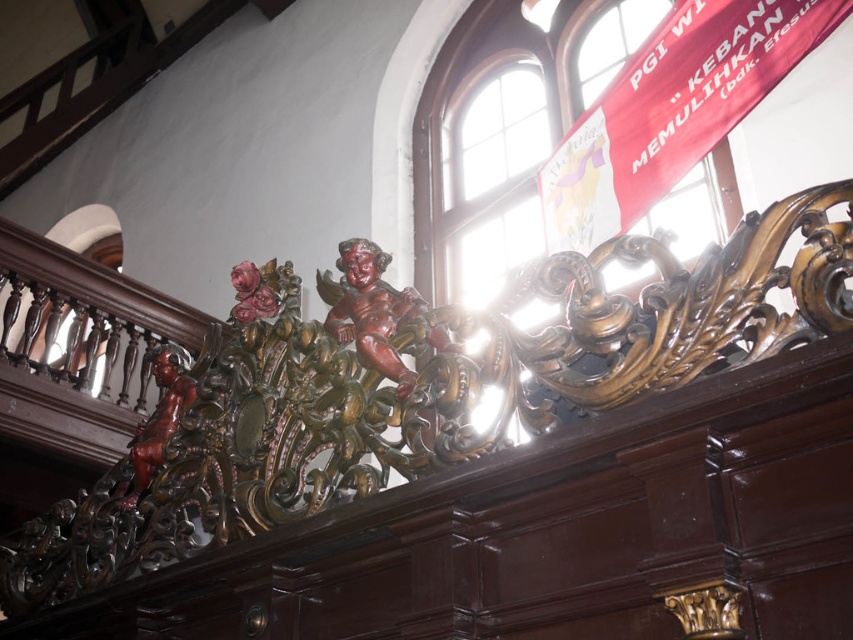
Does transparent glass window at upper center have a lesser height compared to polished dark wood cherub at center?

Incorrect, transparent glass window at upper center's height does not fall short of polished dark wood cherub at center's.

Which of these two, transparent glass window at upper center or polished dark wood cherub at center, stands taller?

transparent glass window at upper center is taller.

Measure the distance between transparent glass window at upper center and camera.

transparent glass window at upper center and camera are 18.27 meters apart from each other.

Identify the location of transparent glass window at upper center. (491, 141).

Can you confirm if wooden carving at center is bigger than transparent glass window at upper center?

Yes.

Does wooden carving at center come in front of transparent glass window at upper center?

That is True.

Where is `wooden carving at center`? wooden carving at center is located at coordinates (486, 461).

The width and height of the screenshot is (853, 640). I want to click on wooden carving at center, so click(486, 461).

Does wooden carving at center have a lesser width compared to polished dark wood cherub at center?

No.

Looking at this image, is wooden carving at center below polished dark wood cherub at center?

Yes.

Identify the location of wooden carving at center. (486, 461).

Find the location of `wooden carving at center`. wooden carving at center is located at coordinates (486, 461).